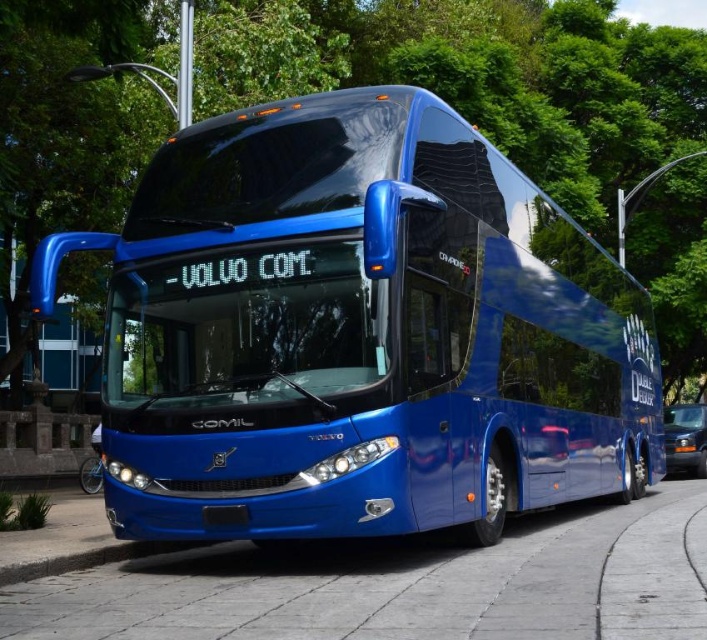
Consider the image. You are a city planner analyzing the space requirements for the glossy blue bus at center and the cobblestone pavement at center. Based on the scene, which object occupies more area in the image?

The glossy blue bus at center is larger in size than the cobblestone pavement at center, so it occupies more area in the image.